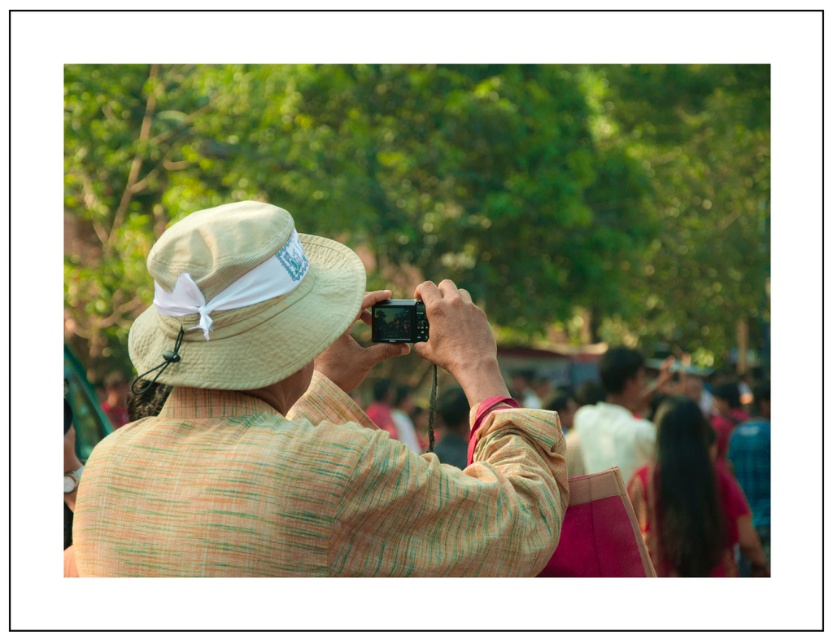
You are a photographer at an event. You see a person in a white cotton shirt at center and a matte black camera at center. Which object is wider?

The white cotton shirt at center might be wider than matte black camera at center according to the description.

You are a photographer trying to capture the crowd in the background. You notice the beige straw hat at center and the matte black camera at center in your viewfinder. Which object should you move your camera to the right to focus on?

The beige straw hat at center is to the left of the matte black camera at center. To focus on the beige straw hat at center, you should move your camera to the right since it is positioned to the left of the matte black camera at center.

You are a fashion designer observing the scene. You need to decide which hat to recommend for a client who prefers wider hats. Which one should you choose between the textured beige hat at center and the beige straw hat at center?

The textured beige hat at center is wider than the beige straw hat at center, so the textured beige hat at center would be the better recommendation for a wider hat.